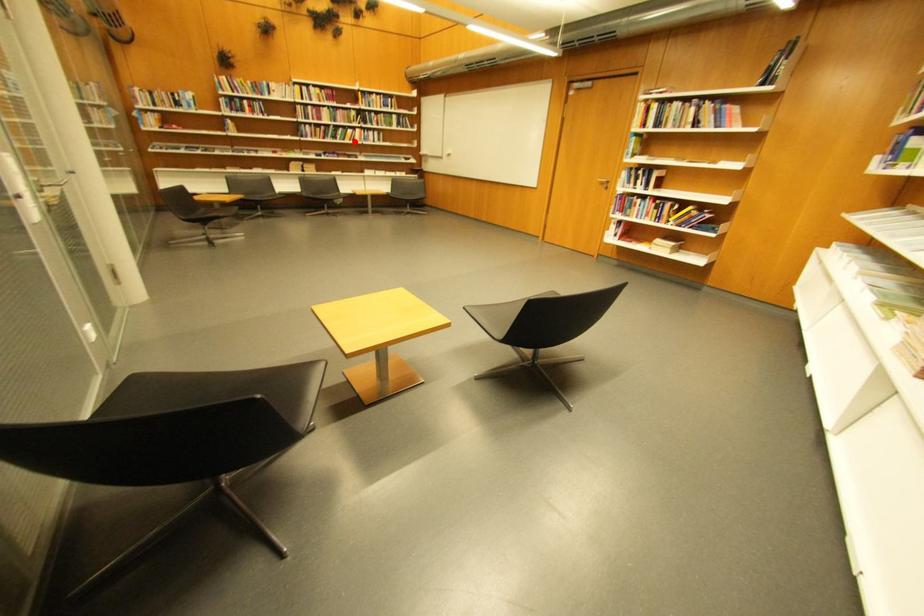
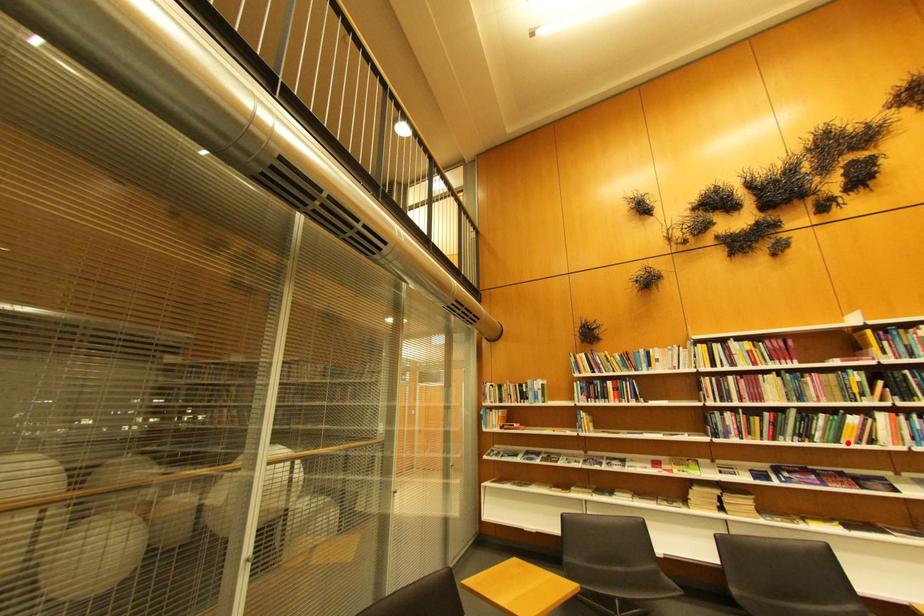
I am providing you with two images of the same scene from different viewpoints. A red point is marked on the first image and another point is marked on the second image. Do the highlighted points in image1 and image2 indicate the same real-world spot?

Yes